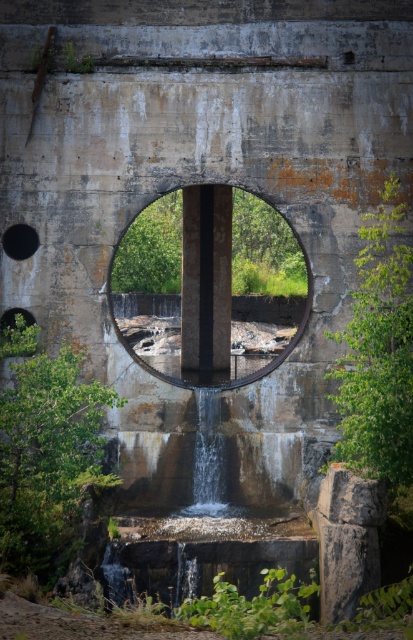
Question: Does green leafy plant at right appear over clear water at center?

Choices:
 (A) no
 (B) yes

Answer: (B)

Question: Which point is farther from the camera taking this photo?

Choices:
 (A) (370, 234)
 (B) (218, 484)
 (C) (121, 289)

Answer: (C)

Question: Does concrete/rough hole at center have a smaller size compared to green leafy tree at lower left?

Choices:
 (A) no
 (B) yes

Answer: (A)

Question: Which of these objects is positioned closest to the green leafy plant at right?

Choices:
 (A) black matte hole at upper left
 (B) concrete/rough hole at center
 (C) green leafy bush at lower left
 (D) green leafy tree at lower left

Answer: (D)

Question: Does green leafy tree at lower left have a larger size compared to green leafy plant at right?

Choices:
 (A) no
 (B) yes

Answer: (B)

Question: Which of the following is the closest to the observer?

Choices:
 (A) (204, 472)
 (B) (7, 323)

Answer: (A)